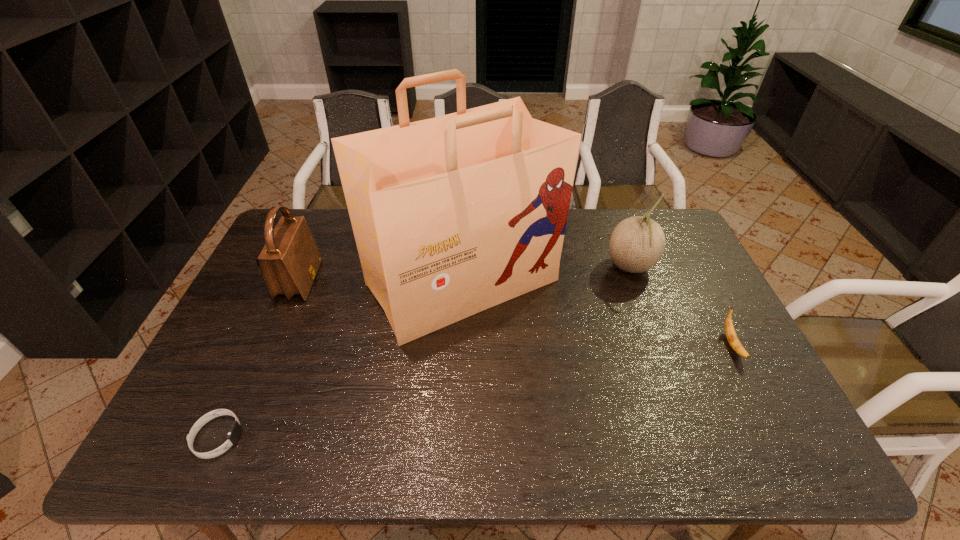
Locate an element on the screen. The height and width of the screenshot is (540, 960). object at the near left corner is located at coordinates (235, 431).

Find the location of a particular element. Image resolution: width=960 pixels, height=540 pixels. object located at the far right corner is located at coordinates (637, 243).

In the image, there is a desktop. Identify the location of vacant space at the far edge. pos(610,209).

This screenshot has height=540, width=960. In order to click on free spot at the near edge of the desktop in this screenshot , I will do `click(369, 432)`.

Identify the location of vacant region at the left edge of the desktop. Image resolution: width=960 pixels, height=540 pixels. (274, 331).

In the image, there is a desktop. Identify the location of free region at the right edge. (693, 257).

Where is `free region at the far left corner of the desktop`? free region at the far left corner of the desktop is located at coordinates (324, 233).

You are a GUI agent. You are given a task and a screenshot of the screen. Output one action in this format:
    pyautogui.click(x=<x>, y=<y>)
    Task: Click on the unoccupied position between the banana and the grocery bag
    Image resolution: width=960 pixels, height=540 pixels.
    Given the screenshot: What is the action you would take?
    pyautogui.click(x=597, y=314)

Locate an element on the screen. Image resolution: width=960 pixels, height=540 pixels. free spot between the nearest object and the shoulder bag is located at coordinates (258, 359).

Where is `free space between the banana and the nearest object`? The height and width of the screenshot is (540, 960). free space between the banana and the nearest object is located at coordinates (475, 391).